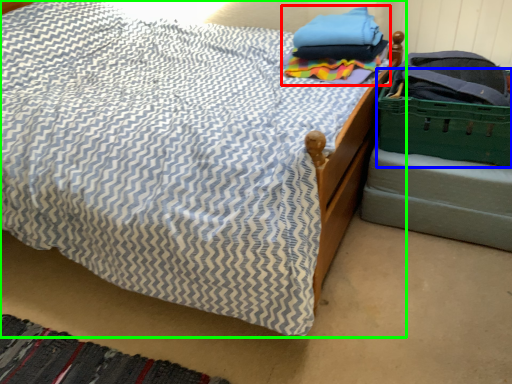
Question: Which is nearer to the clothing (highlighted by a red box)? basket (highlighted by a blue box) or bed (highlighted by a green box).

Choices:
 (A) basket
 (B) bed

Answer: (A)